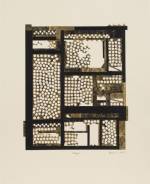
Locate an element on the screen. entryway is located at coordinates (62, 27), (126, 114), (24, 128).